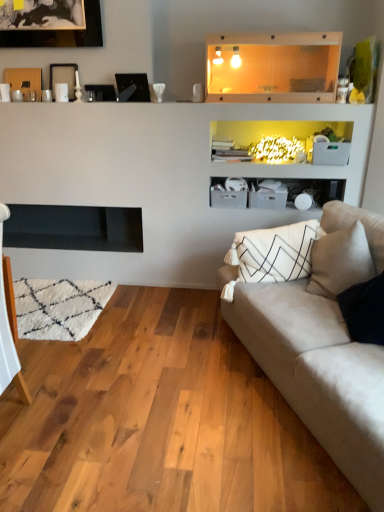
Question: From the image's perspective, is black glass picture frame at upper center, the 1th picture frame when ordered from right to left, located above or below black matte fireplace at left?

Choices:
 (A) above
 (B) below

Answer: (A)

Question: From a real-world perspective, relative to black matte fireplace at left, is black glass picture frame at upper center, the 1th picture frame when ordered from right to left, vertically above or below?

Choices:
 (A) below
 (B) above

Answer: (B)

Question: Which of these objects is positioned farthest from the wooden picture frame at upper left, the third picture frame from the right?

Choices:
 (A) transparent glass shelf at upper center
 (B) suede beige couch at right
 (C) black glass picture frame at upper center, the 1th picture frame when ordered from right to left
 (D) black matte fireplace at left
 (E) black matte picture frame at upper left, the 4th picture frame from the right

Answer: (B)

Question: Which of these objects is positioned closest to the transparent glass shelf at upper center?

Choices:
 (A) matte black picture frame at upper center, which is the 3th picture frame from left to right
 (B) black matte picture frame at upper left, the 4th picture frame from the right
 (C) wooden picture frame at upper left, the third picture frame from the right
 (D) black glass picture frame at upper center, the 1th picture frame when ordered from right to left
 (E) black matte fireplace at left

Answer: (D)